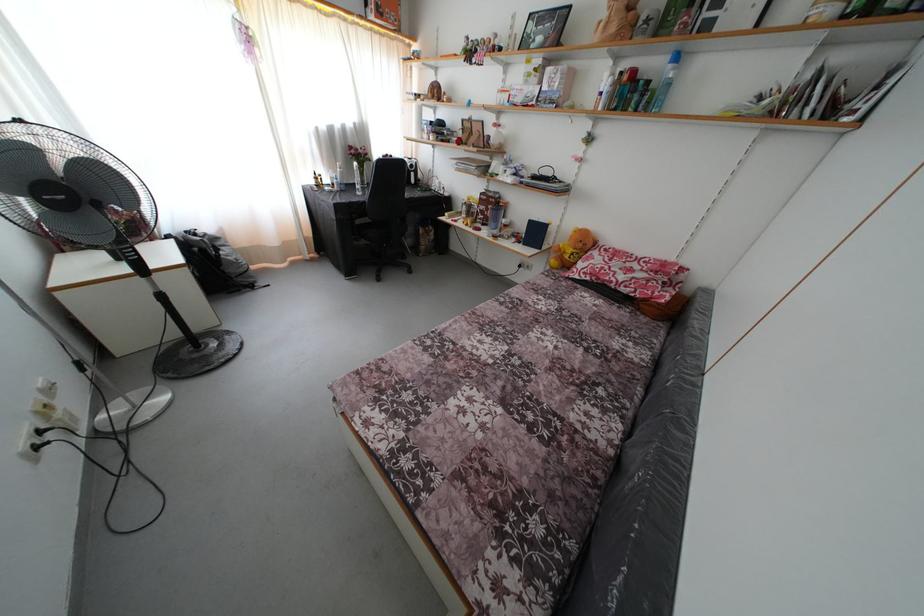
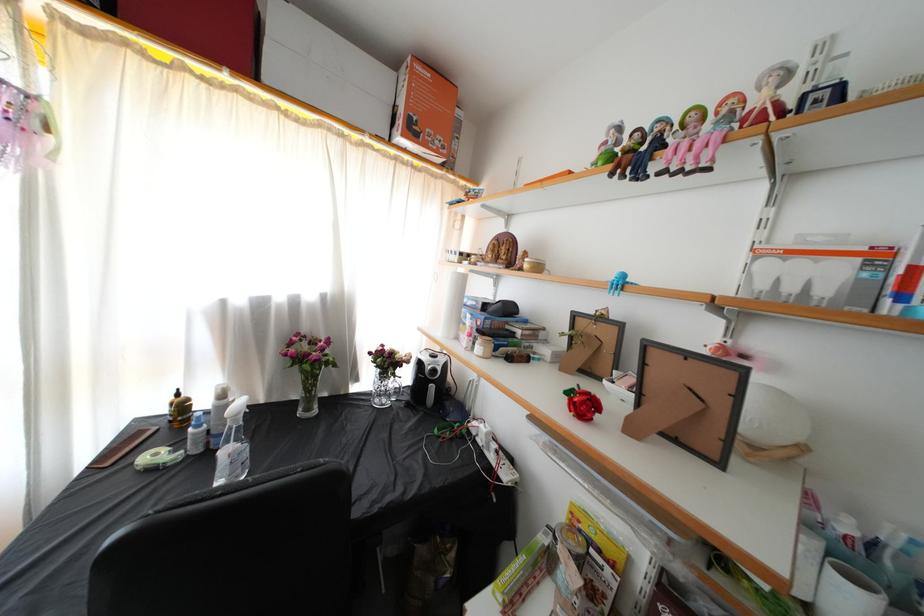
Where in the second image is the point corresponding to point 479,66 from the first image?

(659, 172)